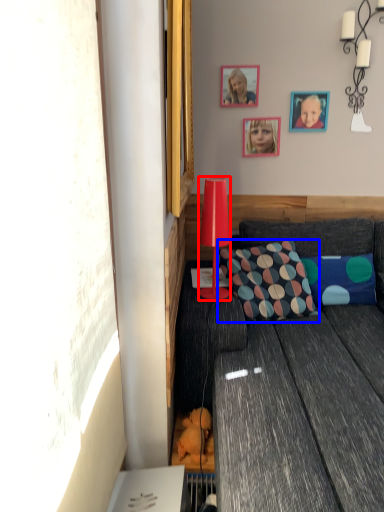
Question: Which object is closer to the camera taking this photo, lamp (highlighted by a red box) or pillow (highlighted by a blue box)?

Choices:
 (A) lamp
 (B) pillow

Answer: (A)